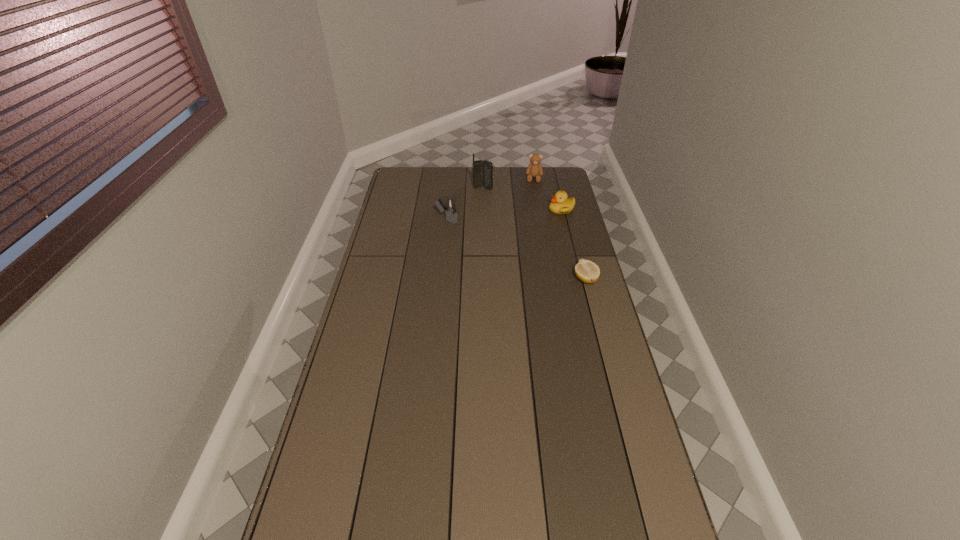
This screenshot has width=960, height=540. Find the location of `free spot between the igniter and the nearest object`. free spot between the igniter and the nearest object is located at coordinates (516, 249).

Where is `unoccupied position between the teddy bear and the lemon`? The width and height of the screenshot is (960, 540). unoccupied position between the teddy bear and the lemon is located at coordinates (560, 228).

Identify the location of vacant region between the shortest object and the igniter. Image resolution: width=960 pixels, height=540 pixels. (516, 249).

Where is `unoccupied area between the farthest object and the shortest object`? The height and width of the screenshot is (540, 960). unoccupied area between the farthest object and the shortest object is located at coordinates (560, 228).

Identify the location of vacant space that's between the second object from left to right and the duckling. (522, 199).

This screenshot has height=540, width=960. Identify the location of unoccupied position between the nearest object and the duckling. (573, 244).

Identify the location of unoccupied area between the cellular telephone and the igniter. This screenshot has height=540, width=960. (465, 204).

The width and height of the screenshot is (960, 540). Identify the location of free spot between the igniter and the duckling. (504, 214).

The height and width of the screenshot is (540, 960). I want to click on free space between the tallest object and the shortest object, so click(x=534, y=234).

I want to click on vacant area between the leftmost object and the lemon, so click(x=516, y=249).